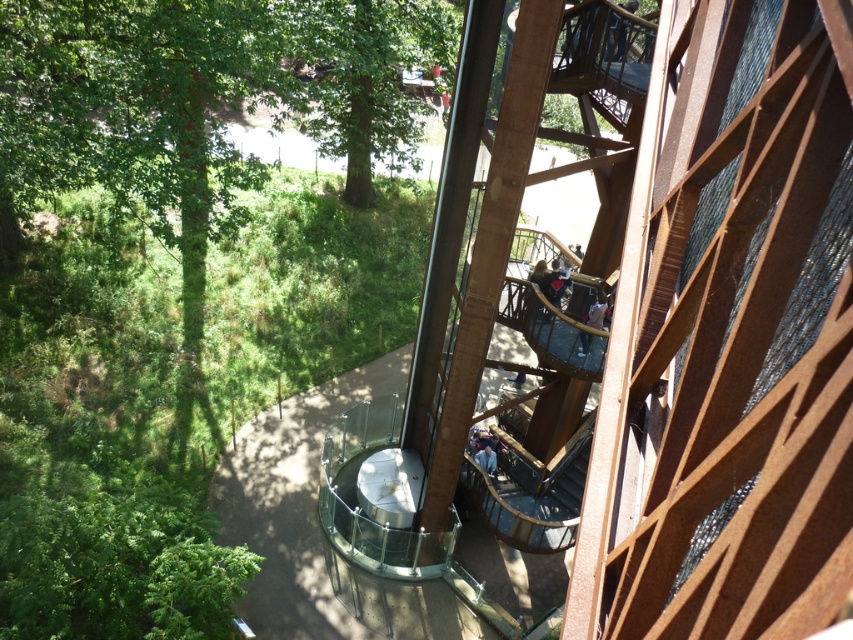
You are standing on the observation deck and want to determine which of the two points, point (7, 83) or point (339, 36), is closer to you. Based on the structure, which point is nearer?

Point (7, 83) is closer to the viewer than point (339, 36), so it is the nearer one.

You are standing on the observation deck and notice two green leafy trees in the scene. Which tree, the green leafy tree at left or the green leafy tree at upper left, is wider in terms of its physical dimensions?

The green leafy tree at left is wider than the green leafy tree at upper left.

You are standing on the observation deck and notice two green leafy trees in the distance. The trees are labeled as the green leafy tree at left and the green leafy tree at upper left. Which tree appears closer to you based on their positions?

The green leafy tree at left appears closer because it is positioned in front of the green leafy tree at upper left, indicating it is nearer to the observer.